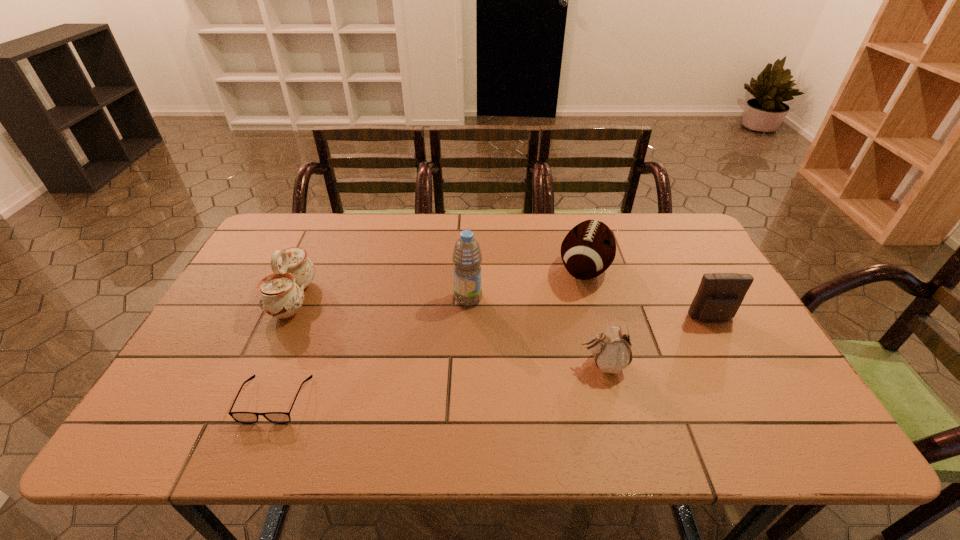
In the image, there is a desktop. Where is `vacant space at the near edge`? vacant space at the near edge is located at coordinates (514, 415).

In order to click on vacant space at the left edge of the desktop in this screenshot , I will do `click(241, 340)`.

The image size is (960, 540). Find the location of `vacant region at the far left corner of the desktop`. vacant region at the far left corner of the desktop is located at coordinates (286, 231).

The width and height of the screenshot is (960, 540). I want to click on vacant space at the near left corner of the desktop, so [x=210, y=422].

Where is `vacant area that lies between the left pouch and the chinaware`? The height and width of the screenshot is (540, 960). vacant area that lies between the left pouch and the chinaware is located at coordinates (448, 332).

The width and height of the screenshot is (960, 540). I want to click on free space that is in between the football (American) and the water bottle, so click(526, 284).

You are a GUI agent. You are given a task and a screenshot of the screen. Output one action in this format:
    pyautogui.click(x=<x>, y=<y>)
    Task: Click on the free space between the football (American) and the tallest object
    
    Given the screenshot: What is the action you would take?
    526,284

This screenshot has width=960, height=540. What are the coordinates of `vacant space that's between the water bottle and the left pouch` in the screenshot? It's located at (536, 332).

Locate an element on the screen. unoccupied area between the farther pouch and the shortest object is located at coordinates (493, 359).

At what (x,y) coordinates should I click in order to perform the action: click on vacant space in between the rightmost object and the tallest object. Please return your answer as a coordinate pair (x, y). The height and width of the screenshot is (540, 960). Looking at the image, I should click on (590, 309).